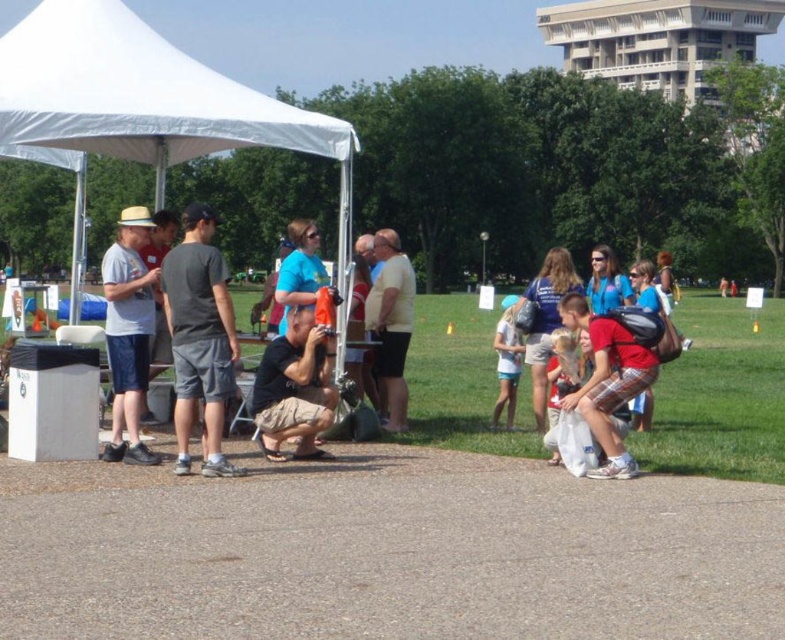
You are standing at the point labeled as point (196, 97) in the park. A friend is at your current location and wants to throw a frisbee to you. If they can throw it 15 meters, will they be able to reach you?

The distance between point (196, 97) and the viewer is 13.52 meters, so yes, the friend can throw the frisbee to you since the distance is within their 15 meters range.